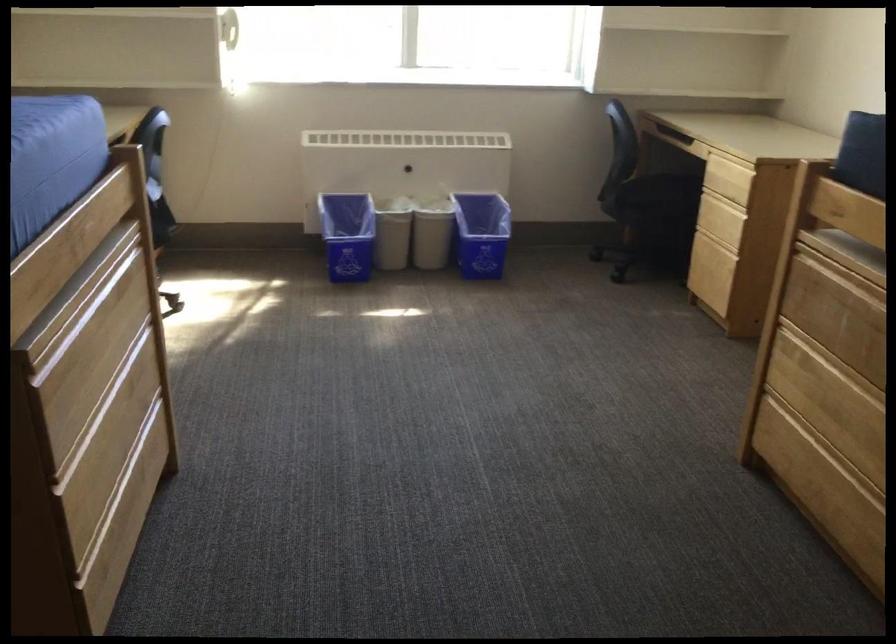
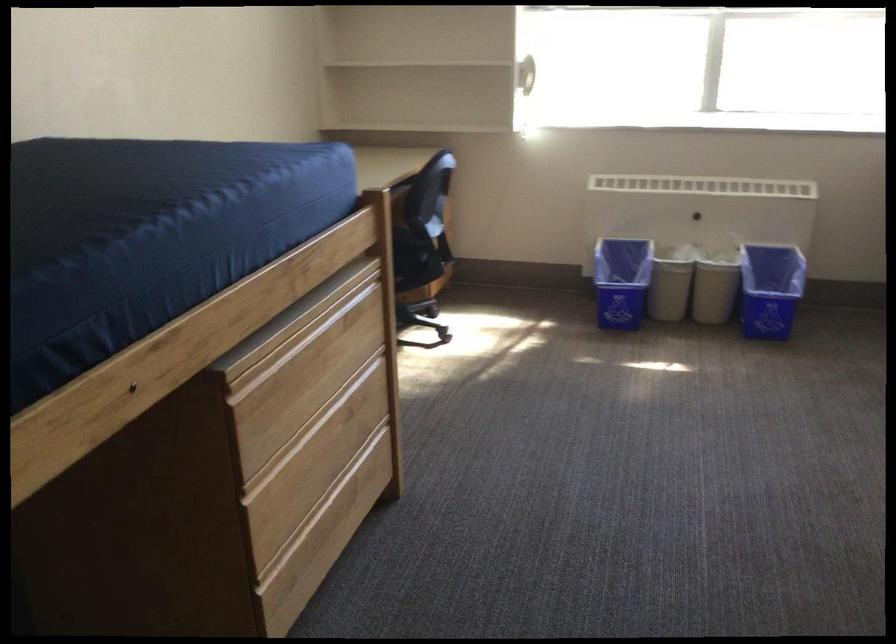
Where in the second image is the point corresponding to the point at 393,232 from the first image?

(670, 281)